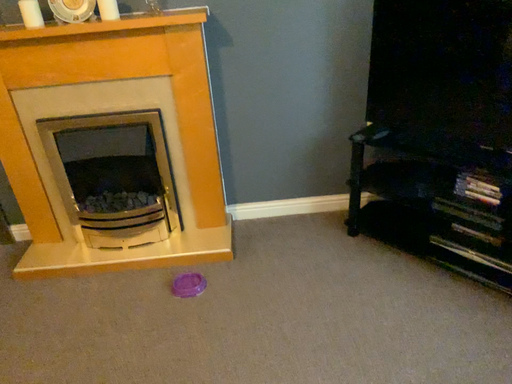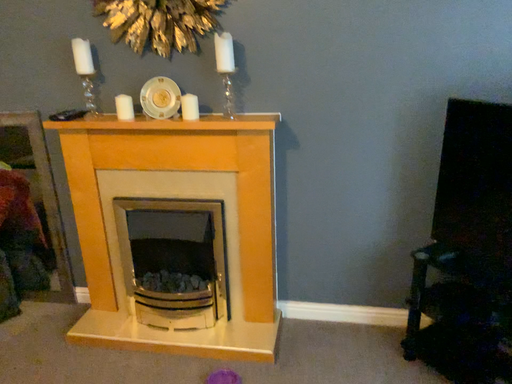
Question: How did the camera likely rotate when shooting the video?

Choices:
 (A) rotated upward
 (B) rotated downward

Answer: (A)